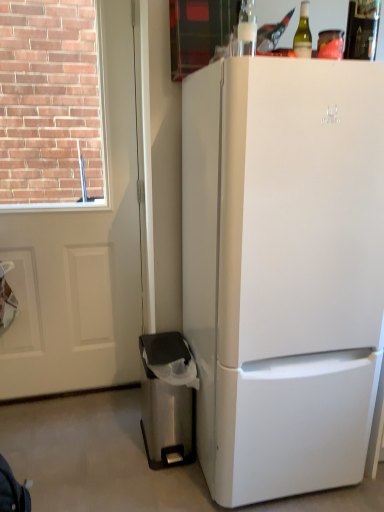
Find the location of `vacant space to the left of white matte refrigerator at right`. vacant space to the left of white matte refrigerator at right is located at coordinates (120, 466).